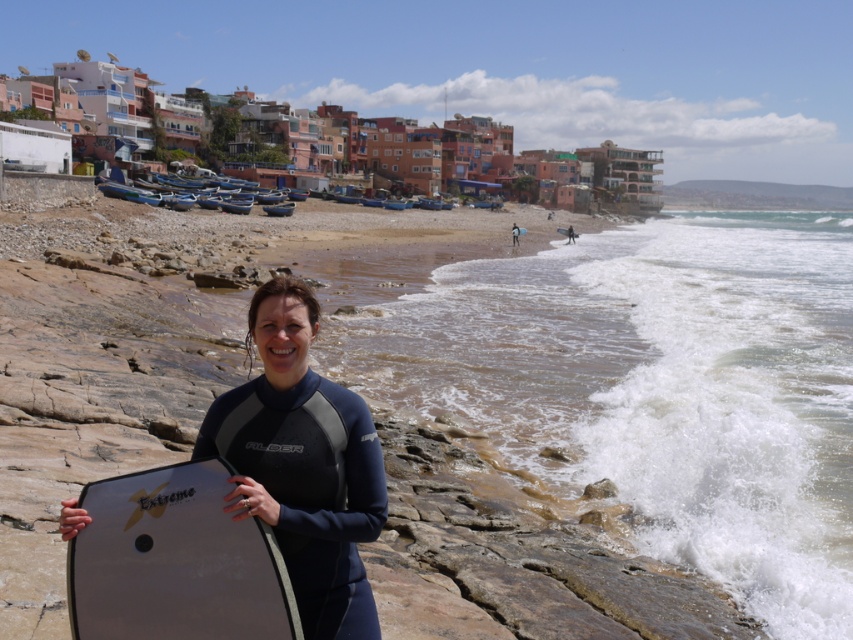
Does point (325, 545) come closer to viewer compared to point (560, 228)?

Yes, point (325, 545) is closer to viewer.

Does black neoprene wetsuit at center appear on the left side of white foam surfboard at lower right?

Correct, you'll find black neoprene wetsuit at center to the left of white foam surfboard at lower right.

This screenshot has height=640, width=853. In order to click on black neoprene wetsuit at center in this screenshot , I will do `click(310, 490)`.

Does white frothy water at lower right appear on the right side of matte black surfboard at center?

Indeed, white frothy water at lower right is positioned on the right side of matte black surfboard at center.

Where is `white frothy water at lower right`? Image resolution: width=853 pixels, height=640 pixels. white frothy water at lower right is located at coordinates (724, 400).

Which is behind, point (830, 467) or point (187, 468)?

The point (830, 467) is more distant.

Where is `white frothy water at lower right`? The width and height of the screenshot is (853, 640). white frothy water at lower right is located at coordinates (724, 400).

Can you confirm if white frothy water at lower right is positioned below white foam surfboard at lower right?

Yes.

Locate an element on the screen. Image resolution: width=853 pixels, height=640 pixels. white frothy water at lower right is located at coordinates (724, 400).

What are the coordinates of `white frothy water at lower right` in the screenshot? It's located at (724, 400).